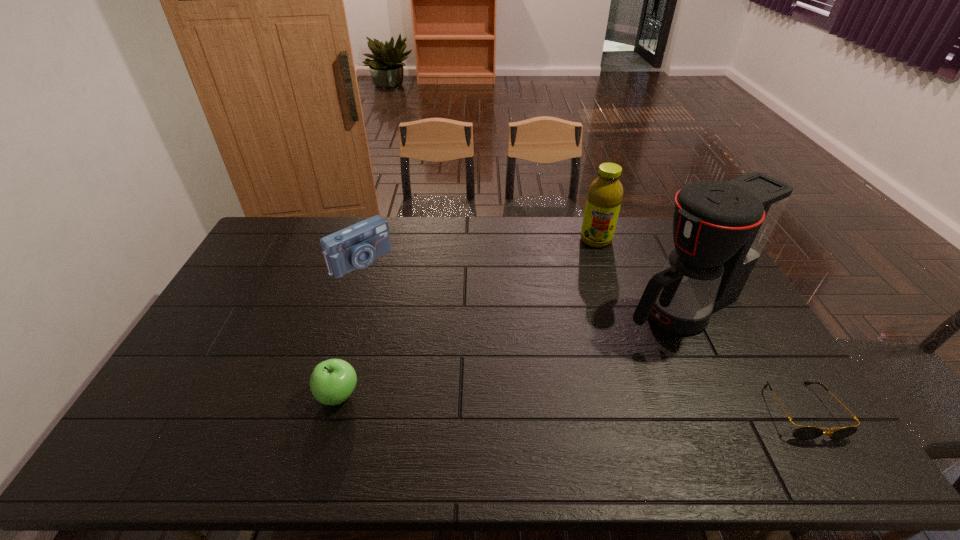
Locate an element on the screen. This screenshot has width=960, height=540. apple is located at coordinates (332, 381).

You are a GUI agent. You are given a task and a screenshot of the screen. Output one action in this format:
    pyautogui.click(x=<x>, y=<y>)
    Task: Click on the sunglasses
    
    Given the screenshot: What is the action you would take?
    pyautogui.click(x=804, y=432)

The image size is (960, 540). Identify the location of the fourth shortest object. (605, 193).

Where is `camera`? Image resolution: width=960 pixels, height=540 pixels. camera is located at coordinates (356, 247).

Where is `coffee maker`? coffee maker is located at coordinates (720, 229).

Locate an element on the screen. The height and width of the screenshot is (540, 960). the third farthest object is located at coordinates (720, 229).

At what (x,y) coordinates should I click in order to perform the action: click on vacant space located 0.200m on the back of the apple. Please return your answer as a coordinate pair (x, y). This screenshot has height=540, width=960. Looking at the image, I should click on (359, 323).

You are a GUI agent. You are given a task and a screenshot of the screen. Output one action in this format:
    pyautogui.click(x=<x>, y=<y>)
    Task: Click on the vacant space situated 0.250m on the front label of the second tallest object
    
    Given the screenshot: What is the action you would take?
    pyautogui.click(x=590, y=294)

The width and height of the screenshot is (960, 540). In order to click on vacant area situated 0.160m on the front label of the second tallest object in this screenshot , I will do `click(592, 277)`.

Image resolution: width=960 pixels, height=540 pixels. In order to click on free location located on the front label of the second tallest object in this screenshot , I will do `click(591, 281)`.